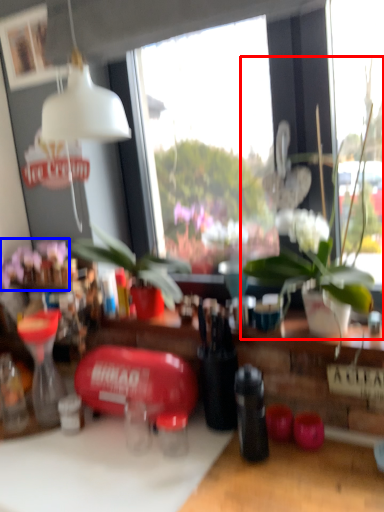
Question: Which object is closer to the camera taking this photo, houseplant (highlighted by a red box) or flower (highlighted by a blue box)?

Choices:
 (A) houseplant
 (B) flower

Answer: (A)